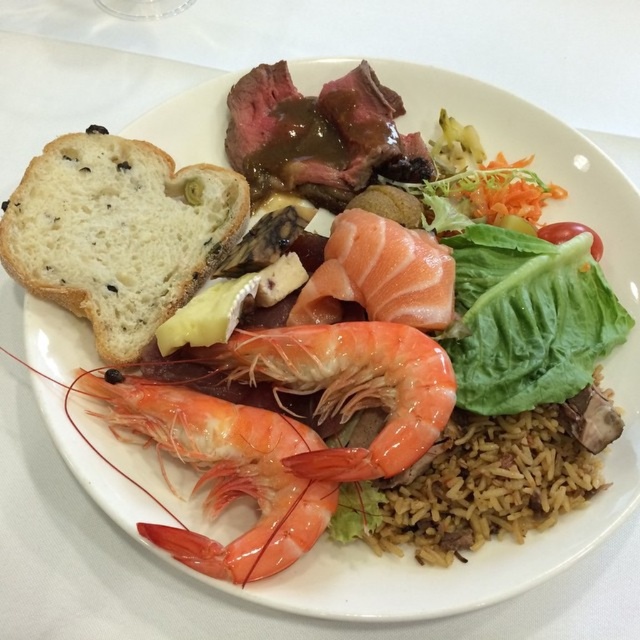
Consider the image. Can you confirm if brown rice at center is taller than green leafy lettuce at center?

In fact, brown rice at center may be shorter than green leafy lettuce at center.

Which is more to the right, brown rice at center or green leafy lettuce at center?

green leafy lettuce at center

Does point (561, 442) come in front of point (525, 298)?

Yes, point (561, 442) is in front of point (525, 298).

Find the location of a particular element. This screenshot has height=640, width=640. brown rice at center is located at coordinates (472, 486).

Between green leafy lettuce at center and pink smooth salmon at center, which one is positioned higher?

pink smooth salmon at center is above.

Does green leafy lettuce at center have a lesser height compared to pink smooth salmon at center?

No.

Between point (500, 248) and point (432, 236), which one is positioned behind?

Point (500, 248)

Locate an element on the screen. The image size is (640, 640). green leafy lettuce at center is located at coordinates (525, 320).

Does white soft bread at left have a greater width compared to green leafy lettuce at center?

Indeed, white soft bread at left has a greater width compared to green leafy lettuce at center.

Who is positioned more to the left, white soft bread at left or green leafy lettuce at center?

From the viewer's perspective, white soft bread at left appears more on the left side.

Is point (113, 321) closer to viewer compared to point (536, 296)?

Yes, point (113, 321) is closer to viewer.

At what (x,y) coordinates should I click in order to perform the action: click on white soft bread at left. Please return your answer as a coordinate pair (x, y). The width and height of the screenshot is (640, 640). Looking at the image, I should click on (118, 234).